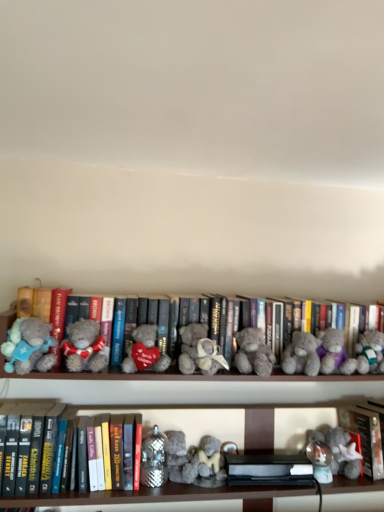
Question: Is red matte book at lower right, positioned as the 1th book in right-to-left order, in front of or behind gray plush toy at right, marked as the first toy in a right-to-left arrangement, in the image?

Choices:
 (A) behind
 (B) front

Answer: (A)

Question: From a real-world perspective, is red matte book at lower right, positioned as the 1th book in right-to-left order, positioned above or below gray plush toy at right, marked as the first toy in a right-to-left arrangement?

Choices:
 (A) above
 (B) below

Answer: (B)

Question: Which is nearer to the fuzzy gray teddy bear at lower right, acting as the second toy starting from the top?

Choices:
 (A) hardcover book at lower left, the third book in the right-to-left sequence
 (B) fluffy gray teddy bear at left, placed as the 6th teddy bear when sorted from right to left
 (C) fluffy gray teddy bear at center, which appears as the 4th teddy bear when viewed from the left
 (D) fluffy gray teddy bear with heart at center, the third teddy bear in the left-to-right sequence
 (E) fluffy gray teddy bear at center, the sixth teddy bear when ordered from left to right

Answer: (E)

Question: Considering the real-world distances, which object is closest to the fuzzy gray teddy bear at lower right, arranged as the 2th toy when viewed from the right?

Choices:
 (A) fuzzy gray teddy bear at center, the fifth teddy bear from the left
 (B) fluffy gray teddy bear at center, the second teddy bear when ordered from right to left
 (C) fluffy gray teddy bear at left, acting as the seventh teddy bear starting from the right
 (D) gray plush bear at center, which appears as the second book when viewed from the left
 (E) red matte book at lower right, the 3th book from the left

Answer: (E)